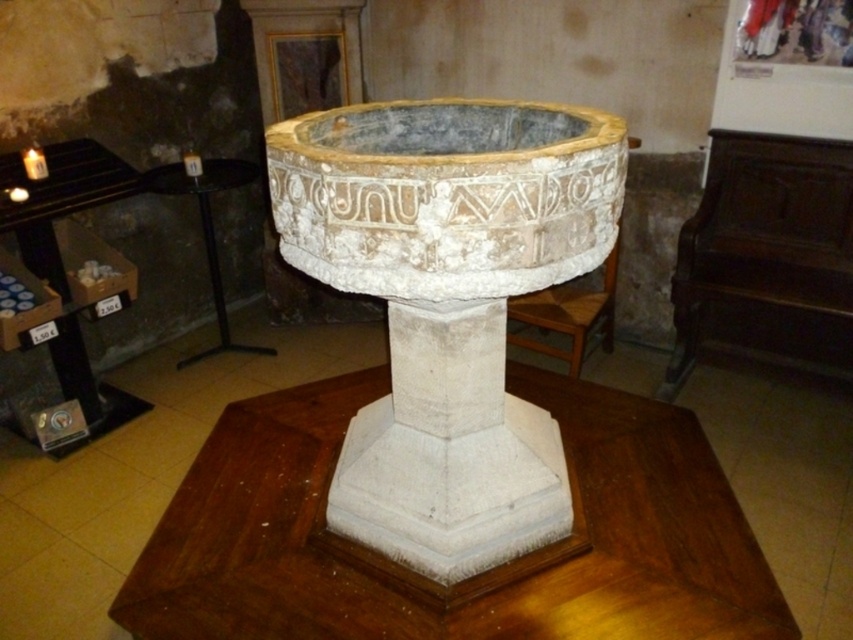
You are an interior designer planning to place a 1.2 meter tall sculpture between the wooden table at center and the black wood table at left. Which table should the sculpture be placed closer to in order to ensure it doesn

The wooden table at center has a lesser height compared to black wood table at left. Therefore, the sculpture should be placed closer to the black wood table at left to ensure the sculpture is visible over both tables.